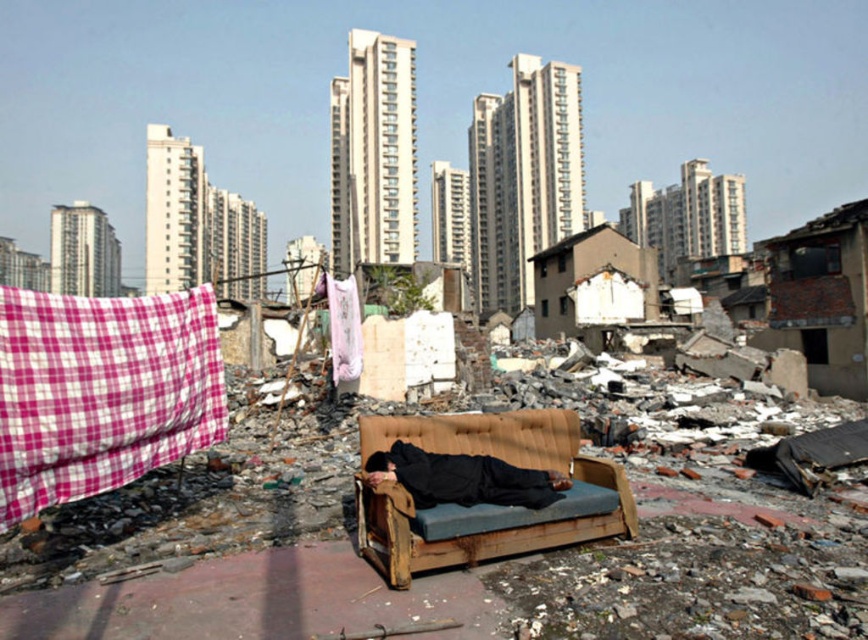
Question: Which point appears farthest from the camera in this image?

Choices:
 (A) (455, 458)
 (B) (523, 456)
 (C) (198, 397)

Answer: (C)

Question: Is wooden couch at center thinner than black fabric person at center?

Choices:
 (A) yes
 (B) no

Answer: (B)

Question: Which of these objects is positioned closest to the pink checkered fabric at left?

Choices:
 (A) black fabric person at center
 (B) wooden couch at center

Answer: (B)

Question: Estimate the real-world distances between objects in this image. Which object is farther from the wooden couch at center?

Choices:
 (A) black fabric person at center
 (B) pink checkered fabric at left

Answer: (B)

Question: Where is pink checkered fabric at left located in relation to black fabric person at center in the image?

Choices:
 (A) below
 (B) above

Answer: (B)

Question: Is pink checkered fabric at left wider than wooden couch at center?

Choices:
 (A) no
 (B) yes

Answer: (A)